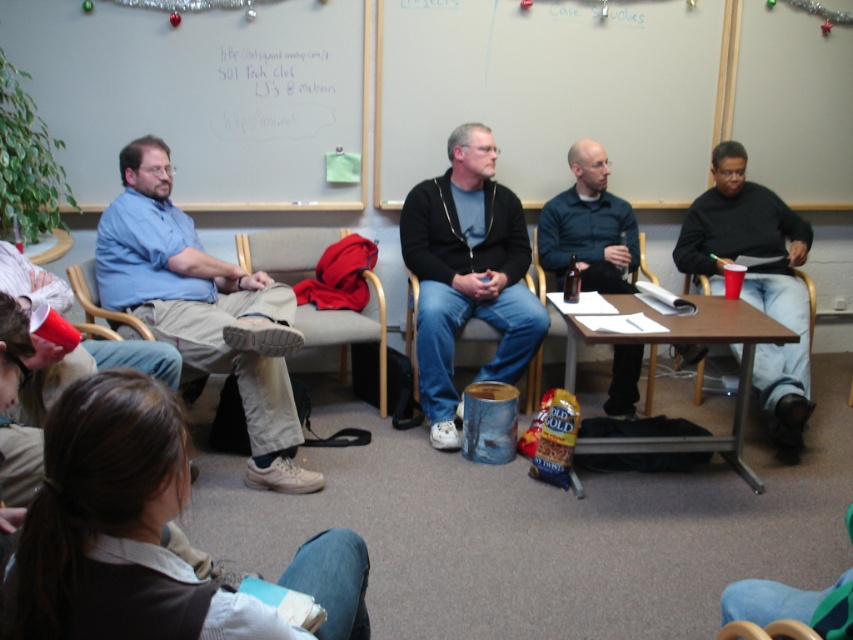
You are organizing a small event and need to place a 1.5 meter long banner between the brown wooden table at center and the red fabric armchair at center. Can the banner fit between them based on their widths?

The brown wooden table at center is wider than the red fabric armchair at center. However, the banner is 1.5 meters long. To determine if it fits between them, you need to know the distance between the two objects, not their widths. The provided information only states their relative widths, not the space between them. Therefore, it is impossible to confirm if the banner will fit based on the given details.

You are standing at the entrance of the room and want to place a large plant on the brown wooden table at center. To ensure the plant won not block the view of the whiteboard at the back, should you place it closer to the edge facing the entrance or the opposite edge?

Place the large plant closer to the edge facing the entrance. Since the brown wooden table at center is located at point (x=683, y=342), placing it near the entrance side will keep the opposite edge closer to the whiteboard, maintaining an unobstructed view.